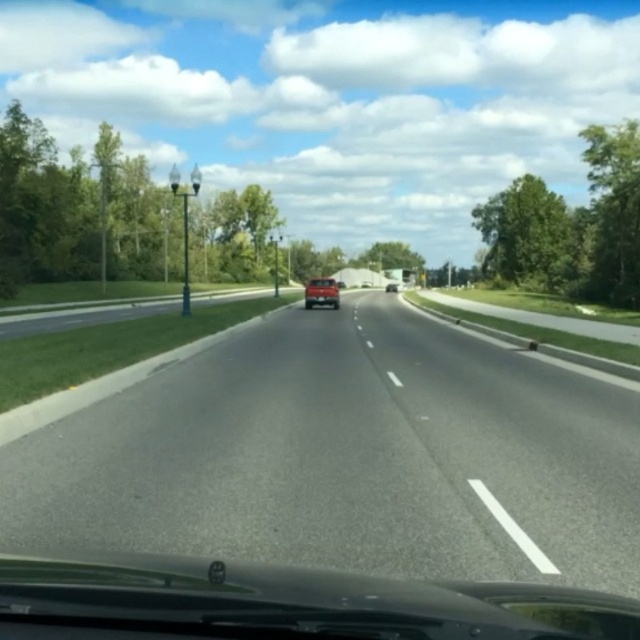
You are a passenger in a car and looking out the window. You see the asphalt road at center and the matte black suv at center. Which object is closer to the bottom of the window?

The asphalt road at center is closer to the bottom of the window because it is positioned below the matte black suv at center.

You are a passenger in the vehicle and looking out the window. You see a shiny red car at center and a matte black suv at center. Which vehicle is closer to the road surface?

The shiny red car at center is located below the matte black suv at center, so it is closer to the road surface.

You are driving a car and see the shiny red car at center represented by point (321, 292). If you want to overtake the shiny red car at center, which direction should you move your car to? Please answer with either left or right.

The shiny red car at center is represented by point (321, 292). To overtake it, you should move your car to the left.